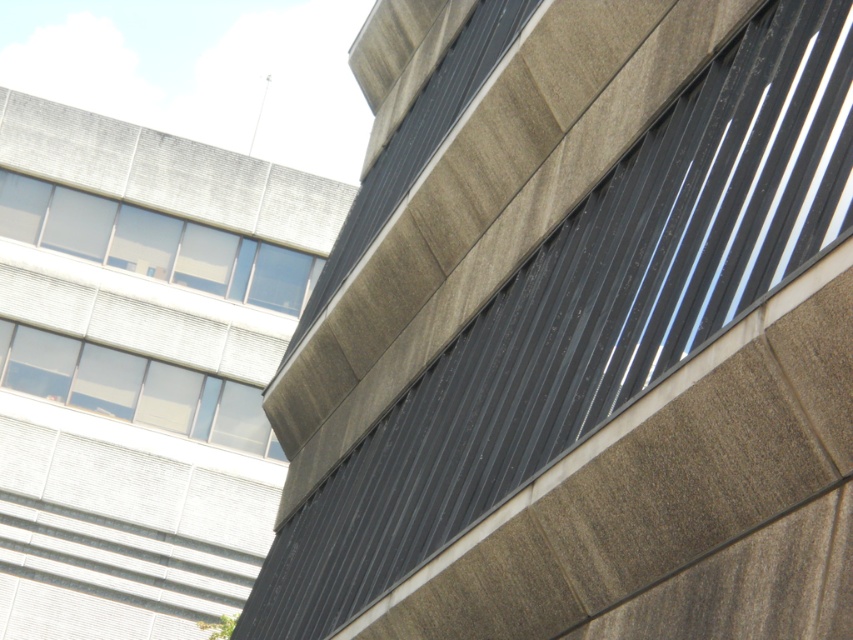
Question: Is clear glass windows at upper left smaller than clear glass window at upper left?

Choices:
 (A) no
 (B) yes

Answer: (A)

Question: Which of the following is the farthest from the observer?

Choices:
 (A) (96, 232)
 (B) (107, 360)

Answer: (A)

Question: Which point is farther from the camera taking this photo?

Choices:
 (A) (187, 406)
 (B) (86, 202)

Answer: (B)

Question: Does clear glass windows at upper left have a greater width compared to clear glass window at upper left?

Choices:
 (A) no
 (B) yes

Answer: (B)

Question: Is clear glass windows at upper left wider than clear glass window at upper left?

Choices:
 (A) yes
 (B) no

Answer: (A)